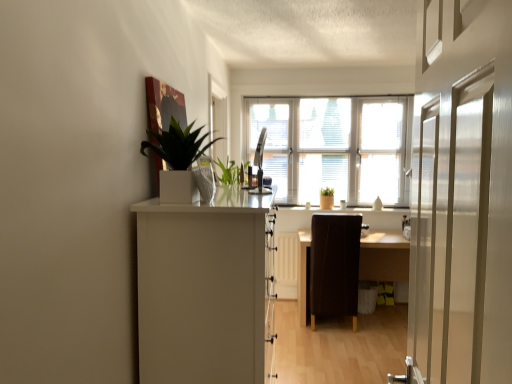
Question: Is brown leather chair at center outside of wooden table at center?

Choices:
 (A) no
 (B) yes

Answer: (A)

Question: Can you confirm if brown leather chair at center is shorter than wooden table at center?

Choices:
 (A) yes
 (B) no

Answer: (B)

Question: From the image's perspective, is brown leather chair at center under wooden table at center?

Choices:
 (A) yes
 (B) no

Answer: (B)

Question: Is brown leather chair at center smaller than wooden table at center?

Choices:
 (A) no
 (B) yes

Answer: (B)

Question: Is brown leather chair at center positioned with its back to wooden table at center?

Choices:
 (A) yes
 (B) no

Answer: (A)

Question: Based on their positions, is white matte cabinet at left located to the left or right of green matte plant at upper left?

Choices:
 (A) right
 (B) left

Answer: (A)

Question: From the image's perspective, is white matte cabinet at left located above or below green matte plant at upper left?

Choices:
 (A) below
 (B) above

Answer: (A)

Question: Is point (212, 226) positioned closer to the camera than point (185, 162)?

Choices:
 (A) farther
 (B) closer

Answer: (B)

Question: Based on their sizes in the image, would you say white matte cabinet at left is bigger or smaller than green matte plant at upper left?

Choices:
 (A) big
 (B) small

Answer: (A)

Question: Choose the correct answer: Is metallic silver monitor at center inside wooden table at center or outside it?

Choices:
 (A) outside
 (B) inside

Answer: (A)

Question: Would you say metallic silver monitor at center is to the left or to the right of wooden table at center in the picture?

Choices:
 (A) right
 (B) left

Answer: (B)

Question: In terms of height, does metallic silver monitor at center look taller or shorter compared to wooden table at center?

Choices:
 (A) tall
 (B) short

Answer: (B)

Question: From the image's perspective, is metallic silver monitor at center located above or below wooden table at center?

Choices:
 (A) above
 (B) below

Answer: (A)

Question: From the image's perspective, is green matte plant at upper left above or below wooden table at center?

Choices:
 (A) above
 (B) below

Answer: (A)

Question: In terms of width, does green matte plant at upper left look wider or thinner when compared to wooden table at center?

Choices:
 (A) thin
 (B) wide

Answer: (A)